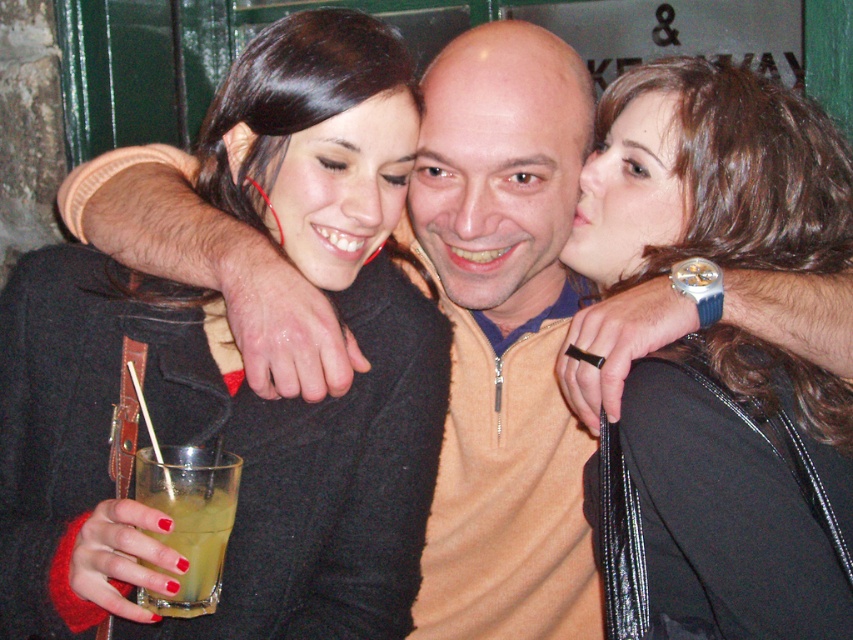
You are a photographer at the event and want to capture a closeup of the matte black sweater at center and the matte black face at center in the same frame. Given that your camera can only focus on objects within 5 inches of each other, will you be able to capture both in focus?

The distance between the matte black sweater at center and the matte black face at center is 5.62 inches, which exceeds the camera focus range of 5 inches. Therefore, you cannot capture both in focus simultaneously.

You are standing in the bar and want to move from point A to point B. Point A is at coordinate point (521,136) and point B is at coordinate point (415,109). Which point is closer to you?

Point A at coordinate point (521,136) is closer to you than point B at coordinate point (415,109) because it is further to the viewer.

You are a photographer at the event and want to take a photo of the smooth skin face at upper right and the yellow translucent glass at lower left. Which object should be placed on the right side of the photo?

The smooth skin face at upper right should be placed on the right side of the photo because it is already positioned to the right of the yellow translucent glass at lower left in the scene.